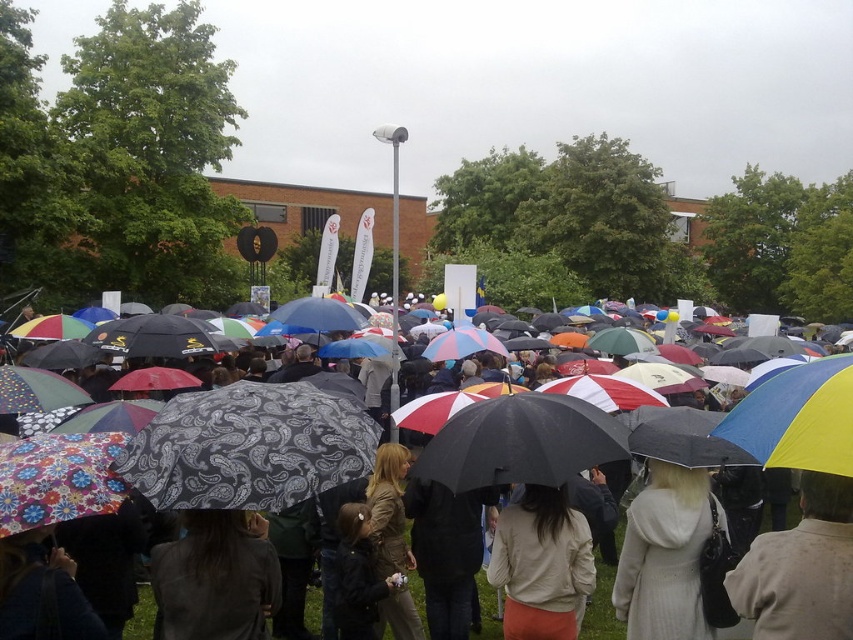
Question: Which of the following is the closest to the observer?

Choices:
 (A) (213, 634)
 (B) (560, 532)
 (C) (837, 529)
 (D) (683, 621)

Answer: (C)

Question: Which of the following is the farthest from the observer?

Choices:
 (A) white wool coat at center
 (B) light beige sweater at lower right

Answer: (A)

Question: Which point is closer to the camera?

Choices:
 (A) white wool coat at center
 (B) dark gray paisley-patterned umbrella at center
 (C) beige fabric jacket at center

Answer: (B)

Question: Is the position of white wool coat at center more distant than that of beige fabric jacket at center?

Choices:
 (A) yes
 (B) no

Answer: (A)

Question: Where is light beige sweater at lower right located in relation to dark gray paisley-patterned umbrella at center in the image?

Choices:
 (A) right
 (B) left

Answer: (A)

Question: Can you confirm if white wool coat at center is positioned above dark gray paisley-patterned umbrella at center?

Choices:
 (A) no
 (B) yes

Answer: (A)